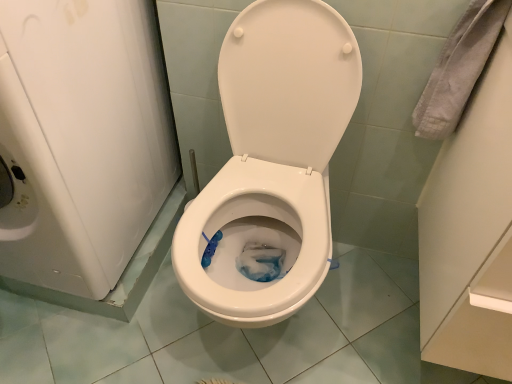
Question: Can you confirm if white glossy toilet at center is taller than white glossy washing machine at left?

Choices:
 (A) no
 (B) yes

Answer: (A)

Question: Is white glossy toilet at center oriented away from white glossy washing machine at left?

Choices:
 (A) yes
 (B) no

Answer: (B)

Question: From a real-world perspective, is white glossy toilet at center on white glossy washing machine at left?

Choices:
 (A) yes
 (B) no

Answer: (B)

Question: Is white glossy toilet at center further to camera compared to white glossy washing machine at left?

Choices:
 (A) yes
 (B) no

Answer: (A)

Question: Is white glossy toilet at center wider than white glossy washing machine at left?

Choices:
 (A) yes
 (B) no

Answer: (B)

Question: From the image's perspective, is white glossy toilet at center located above white glossy washing machine at left?

Choices:
 (A) no
 (B) yes

Answer: (A)

Question: Does white glossy washing machine at left have a greater width compared to white glossy toilet at center?

Choices:
 (A) no
 (B) yes

Answer: (B)

Question: Can you confirm if white glossy washing machine at left is smaller than white glossy toilet at center?

Choices:
 (A) no
 (B) yes

Answer: (A)

Question: From the image's perspective, is white glossy washing machine at left located beneath white glossy toilet at center?

Choices:
 (A) no
 (B) yes

Answer: (A)

Question: Is white glossy washing machine at left turned away from white glossy toilet at center?

Choices:
 (A) no
 (B) yes

Answer: (A)

Question: Is white glossy washing machine at left touching white glossy toilet at center?

Choices:
 (A) no
 (B) yes

Answer: (A)

Question: From a real-world perspective, is white glossy washing machine at left on white glossy toilet at center?

Choices:
 (A) no
 (B) yes

Answer: (B)

Question: Considering the positions of white glossy toilet at center and white glossy washing machine at left in the image, is white glossy toilet at center bigger or smaller than white glossy washing machine at left?

Choices:
 (A) small
 (B) big

Answer: (A)